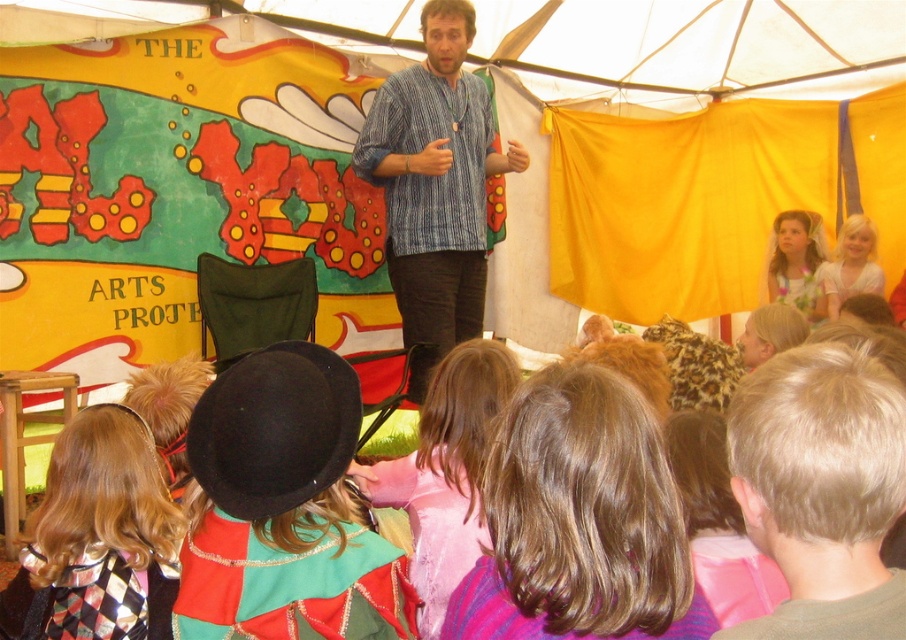
Is pink satin dress at center to the left of light blonde hair at upper right from the viewer's perspective?

Correct, you'll find pink satin dress at center to the left of light blonde hair at upper right.

What do you see at coordinates (446, 472) in the screenshot?
I see `pink satin dress at center` at bounding box center [446, 472].

Identify the location of pink satin dress at center. (446, 472).

Does yellow fabric tent at center have a lesser width compared to pink satin dress at center?

No, yellow fabric tent at center is not thinner than pink satin dress at center.

Does yellow fabric tent at center have a smaller size compared to pink satin dress at center?

No, yellow fabric tent at center is not smaller than pink satin dress at center.

Between point (531, 221) and point (406, 472), which one is positioned in front?

Point (406, 472) is in front.

Identify the location of yellow fabric tent at center. The height and width of the screenshot is (640, 906). (178, 189).

Between point (814, 570) and point (444, 353), which one is positioned in front?

Point (814, 570) is more forward.

Does blonde hair at center lie behind striped cotton shirt at center?

That is False.

Describe the element at coordinates (821, 490) in the screenshot. The height and width of the screenshot is (640, 906). I see `blonde hair at center` at that location.

Where is `blonde hair at center`? The width and height of the screenshot is (906, 640). blonde hair at center is located at coordinates (821, 490).